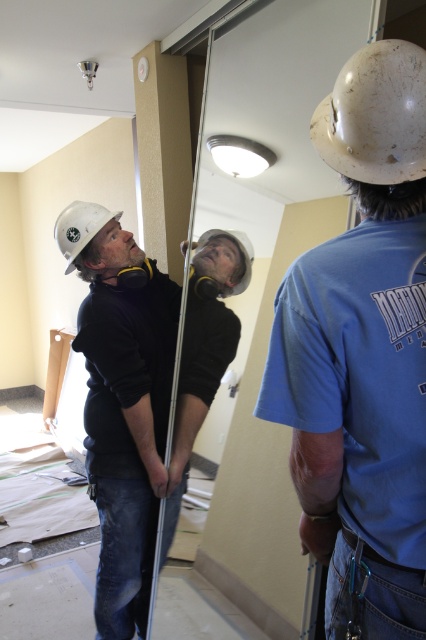
Who is taller, white matte hard hat at upper right or white hard hat at upper center?

white matte hard hat at upper right is taller.

Locate an element on the screen. white matte hard hat at upper right is located at coordinates (362, 348).

Does point (172, 499) come closer to viewer compared to point (411, 134)?

No.

Between point (143, 381) and point (319, 150), which one is positioned behind?

Positioned behind is point (143, 381).

The width and height of the screenshot is (426, 640). I want to click on matte black helmet at center, so click(141, 392).

Is matte black helmet at center bigger than white hard hat at upper center?

Indeed, matte black helmet at center has a larger size compared to white hard hat at upper center.

Is point (158, 352) closer to viewer compared to point (250, 256)?

No, it is behind (250, 256).

Between point (97, 330) and point (247, 284), which one is positioned behind?

Positioned behind is point (247, 284).

Find the location of a particular element. The height and width of the screenshot is (640, 426). matte black helmet at center is located at coordinates pyautogui.click(x=141, y=392).